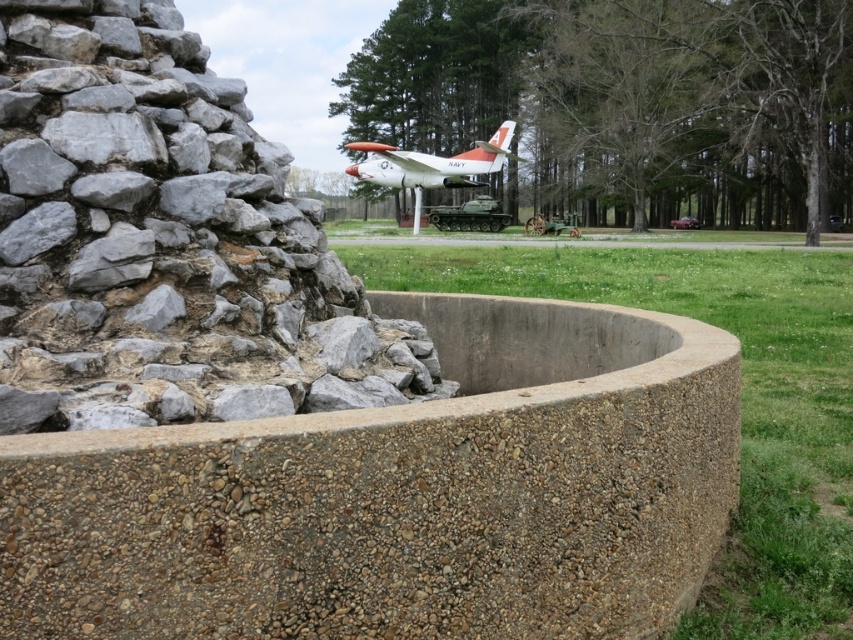
You are standing at the center of the concrete structure with a circular opening. You want to place a small potted plant between the gray rough stone at left and the white and orange airplane with NAVY written on its tail. Which direction should you move the plant to ensure it is closer to the airplane?

The gray rough stone at left is located at point (164, 241), so you should move the plant to the right to be closer to the white and orange airplane with NAVY written on its tail.

You are standing in the outdoor area and want to move from the gray rough stone at left to the orange matte airplane at center. Which direction should you move relative to the airplane?

Since the gray rough stone at left is to the right of the orange matte airplane at center, you should move to the left to reach the airplane from the stone.